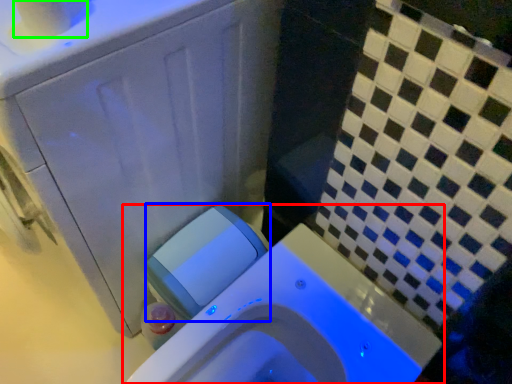
Question: Which is farther away from toilet (highlighted by a red box)? water tank (highlighted by a blue box) or toilet paper (highlighted by a green box)?

Choices:
 (A) water tank
 (B) toilet paper

Answer: (B)